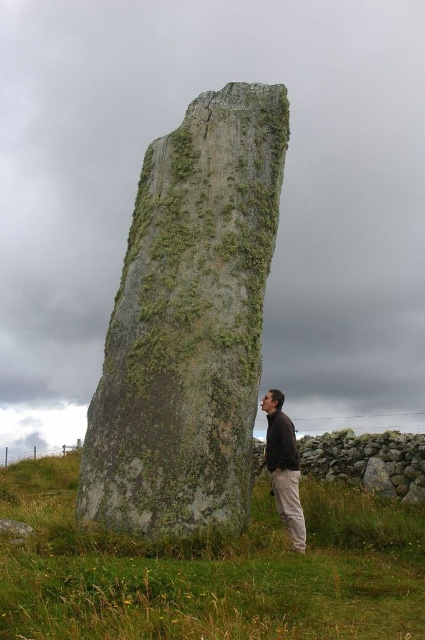
You are a hiker who wants to take a photo of the green mossy stone at center and the green grassy at lower center. Which object should you focus on first if you want to capture both in a single frame without moving the camera?

The green mossy stone at center is much taller than the green grassy at lower center, so you should focus on the green mossy stone at center first to ensure it fits within the frame.

You are standing at the base of the large standing stone and want to place a small marker exactly at the point labeled point (209, 570). According to the image, what will the marker be placed on?

The marker will be placed on green grassy at lower center, as that is what is located at point (209, 570).

Consider the image. You are a hiker who wants to take a photo of the green mossy stone at center and the green grassy at lower center. Which object should you focus on first if you want to capture both in the same frame without moving your camera?

The green mossy stone at center is above green grassy at lower center, so you should focus on the green mossy stone at center first to ensure both are in the frame.